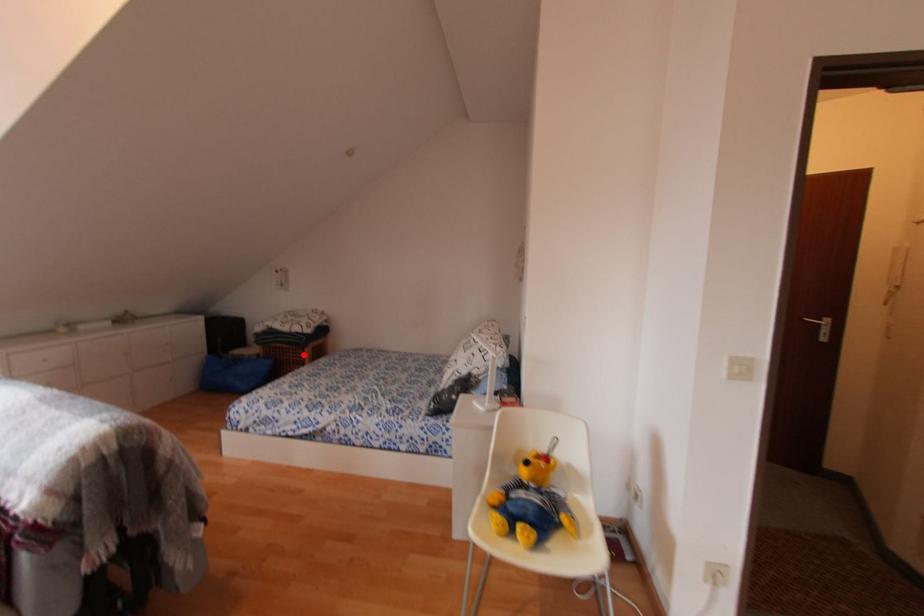
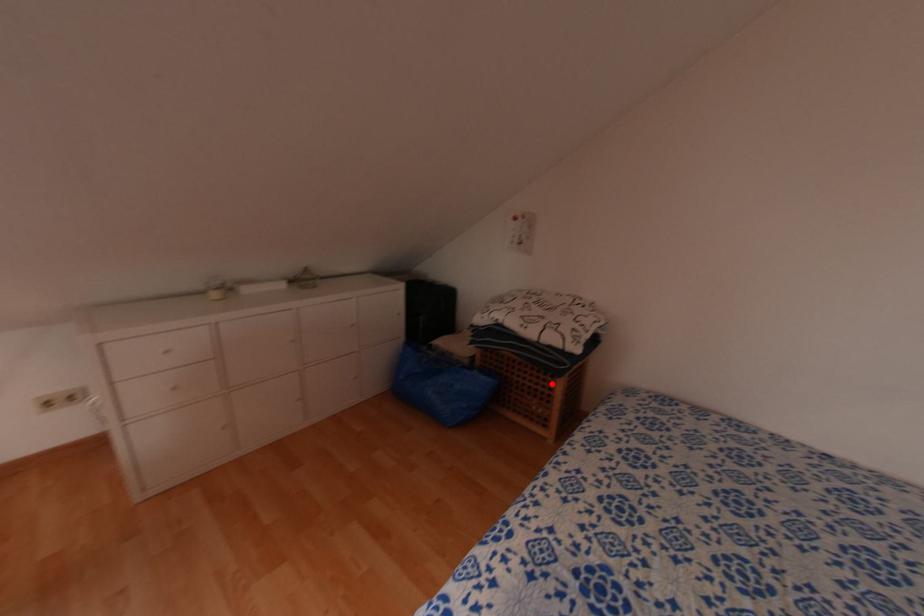
I am providing you with two images of the same scene from different viewpoints. A red point is marked on the first image and another point is marked on the second image. Do the highlighted points in image1 and image2 indicate the same real-world spot?

Yes